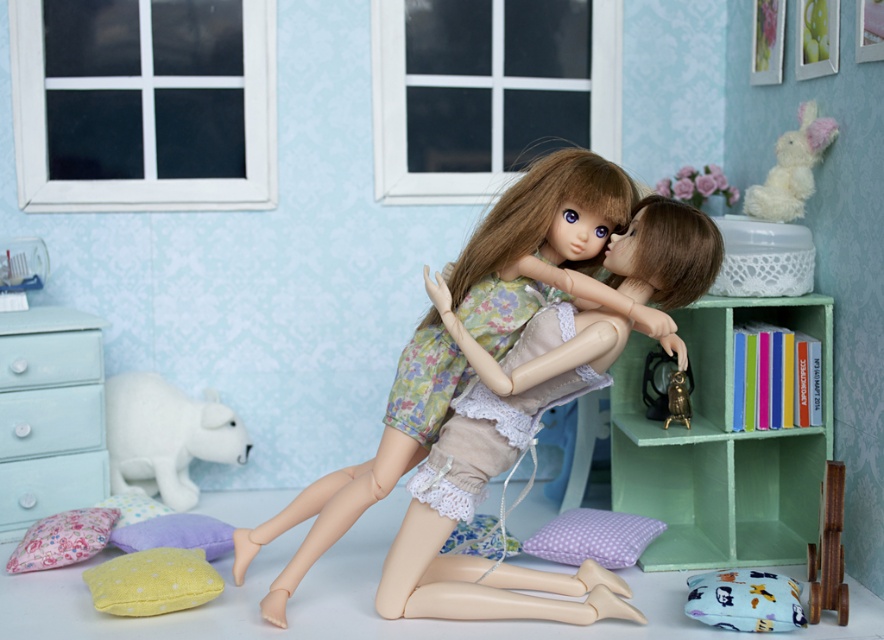
You are a dollhouse designer who wants to place a new decorative item at point (151, 580). What is already present at that location?

The yellow felt pillow at lower left is located at point (151, 580).

You are a small toy that is 12 inches wide. You want to move from the lavender fabric pillow at lower left to the lace fabric pillow at lower center. Can you fit through the space between them?

The distance between the lace fabric pillow at lower center and the lavender fabric pillow at lower left is 33.58 inches. Since the toy is only 12 inches wide, there is sufficient space for it to move through the gap between them.

You are a small toy that needs to move from the floral fabric pillow at lower left to the purple fabric pillow at lower center. Which pillow should you choose as your starting point if you want to move to the smaller pillow?

The floral fabric pillow at lower left is bigger than the purple fabric pillow at lower center, so you should start at the floral fabric pillow at lower left to move to the smaller purple fabric pillow at lower center.